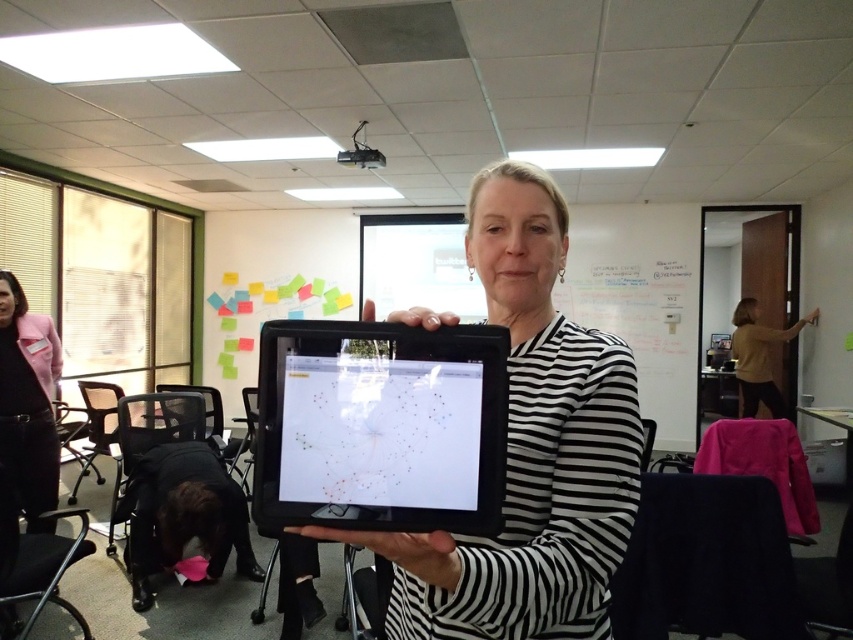
Locate an element on the screen. The image size is (853, 640). black matte tablet at center is located at coordinates (380, 426).

Is black matte tablet at center further to camera compared to white matte whiteboard at upper center?

No, it is not.

Measure the distance between black matte tablet at center and camera.

black matte tablet at center is 76.46 centimeters away from camera.

Locate an element on the screen. Image resolution: width=853 pixels, height=640 pixels. black matte tablet at center is located at coordinates (380, 426).

Looking at this image, is white matte whiteboard at upper center in front of matte brown sweater at right?

No, white matte whiteboard at upper center is behind matte brown sweater at right.

You are a GUI agent. You are given a task and a screenshot of the screen. Output one action in this format:
    pyautogui.click(x=<x>, y=<y>)
    Task: Click on the white matte whiteboard at upper center
    The height and width of the screenshot is (640, 853).
    Given the screenshot: What is the action you would take?
    pyautogui.click(x=642, y=300)

Is black glossy tablet at center thinner than black matte tablet at center?

In fact, black glossy tablet at center might be wider than black matte tablet at center.

Is black glossy tablet at center shorter than black matte tablet at center?

Incorrect, black glossy tablet at center's height does not fall short of black matte tablet at center's.

Measure the distance between black glossy tablet at center and camera.

The distance of black glossy tablet at center from camera is 29.32 inches.

Find the location of `black glossy tablet at center`. black glossy tablet at center is located at coordinates tap(529, 449).